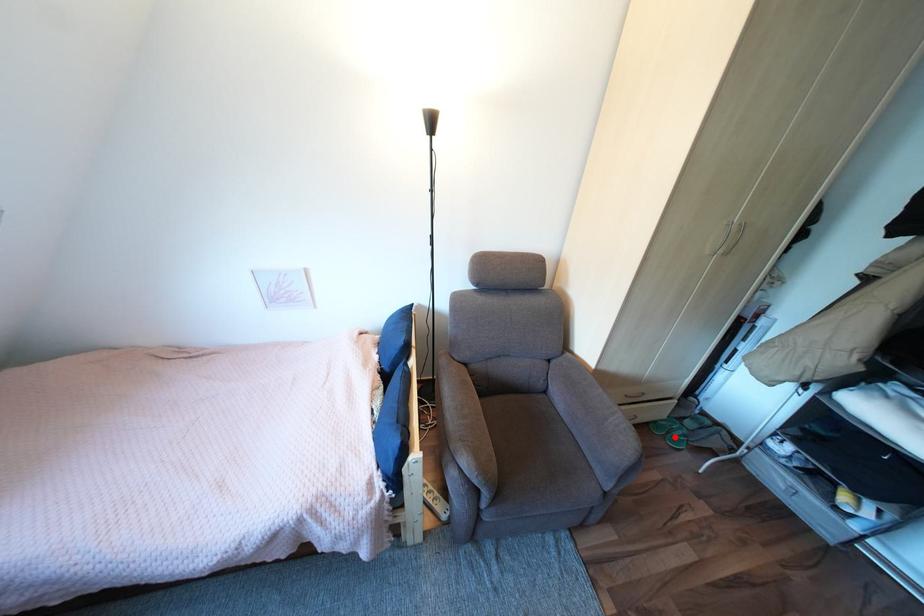
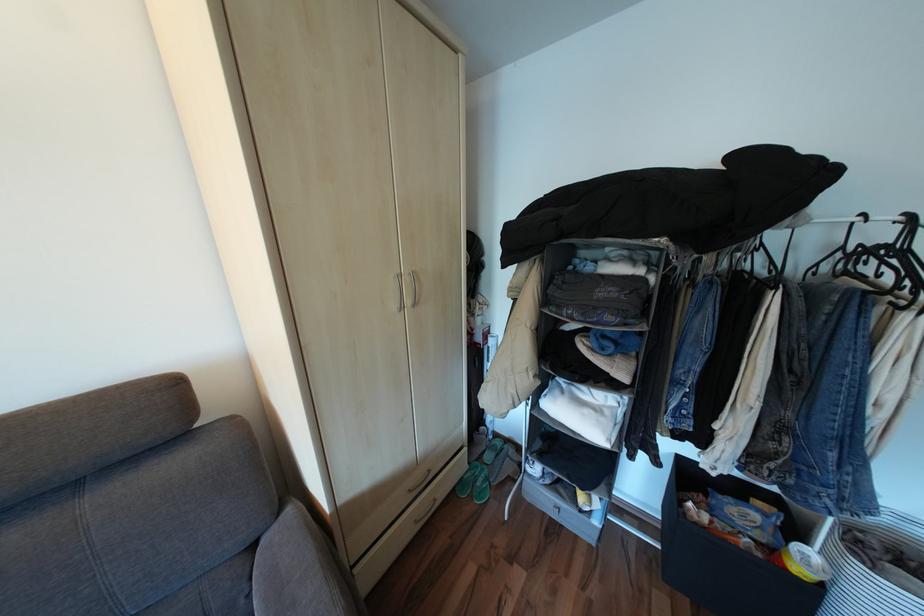
Question: I am providing you with two images of the same scene from different viewpoints. A red point is shown in image1. For the corresponding object point in image2, is it positioned nearer or farther from the camera?

Choices:
 (A) Nearer
 (B) Farther

Answer: (B)